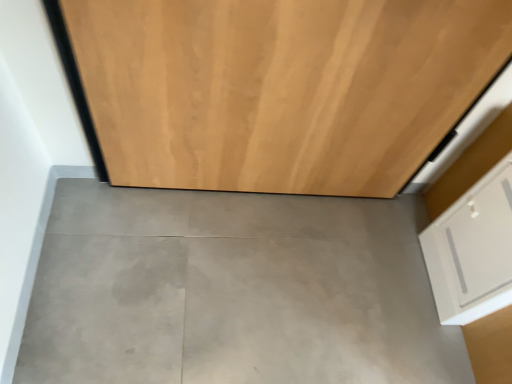
Question: From the image's perspective, is gray concrete floor at center located above white matte drawer at lower right?

Choices:
 (A) no
 (B) yes

Answer: (A)

Question: Is gray concrete floor at center next to white matte drawer at lower right and touching it?

Choices:
 (A) yes
 (B) no

Answer: (B)

Question: From a real-world perspective, is gray concrete floor at center located beneath white matte drawer at lower right?

Choices:
 (A) yes
 (B) no

Answer: (A)

Question: Is gray concrete floor at center smaller than white matte drawer at lower right?

Choices:
 (A) yes
 (B) no

Answer: (B)

Question: From a real-world perspective, is gray concrete floor at center positioned over white matte drawer at lower right based on gravity?

Choices:
 (A) yes
 (B) no

Answer: (B)

Question: Is gray concrete floor at center taller than white matte drawer at lower right?

Choices:
 (A) yes
 (B) no

Answer: (B)

Question: Would you say gray concrete floor at center is part of white matte drawer at lower right's contents?

Choices:
 (A) no
 (B) yes

Answer: (A)

Question: Is white matte drawer at lower right to the left of gray concrete floor at center from the viewer's perspective?

Choices:
 (A) no
 (B) yes

Answer: (A)

Question: From a real-world perspective, is white matte drawer at lower right on gray concrete floor at center?

Choices:
 (A) no
 (B) yes

Answer: (B)

Question: Considering the relative positions of white matte drawer at lower right and gray concrete floor at center in the image provided, is white matte drawer at lower right to the right of gray concrete floor at center from the viewer's perspective?

Choices:
 (A) yes
 (B) no

Answer: (A)

Question: Can we say white matte drawer at lower right lies outside gray concrete floor at center?

Choices:
 (A) no
 (B) yes

Answer: (B)

Question: Considering the relative sizes of white matte drawer at lower right and gray concrete floor at center in the image provided, is white matte drawer at lower right bigger than gray concrete floor at center?

Choices:
 (A) no
 (B) yes

Answer: (A)

Question: Does white matte drawer at lower right have a smaller size compared to wooden door at center?

Choices:
 (A) no
 (B) yes

Answer: (B)